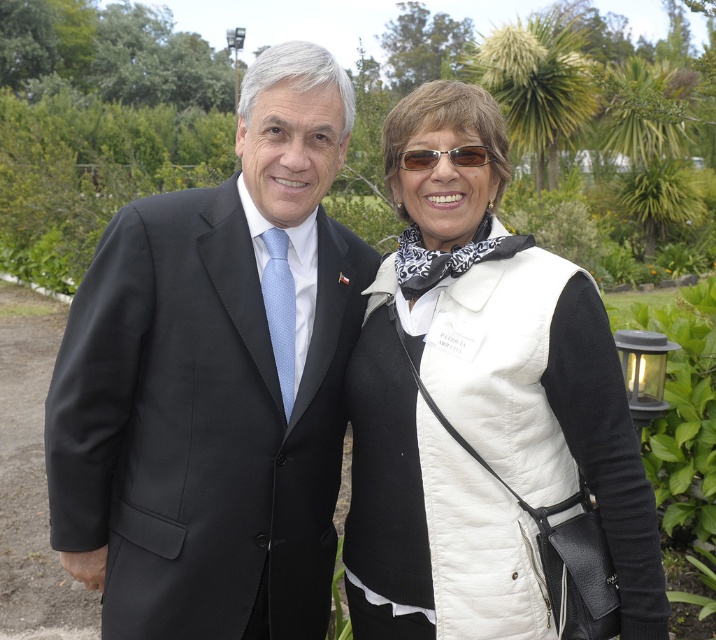
Which is below, black matte suit at center or white quilted vest at center?

white quilted vest at center is below.

Does point (216, 634) lie behind point (422, 634)?

No.

Who is more distant from viewer, (79, 298) or (624, 506)?

The point (79, 298) is more distant.

At what (x,y) coordinates should I click in order to perform the action: click on black matte suit at center. Please return your answer as a coordinate pair (x, y). This screenshot has width=716, height=640. Looking at the image, I should click on (216, 381).